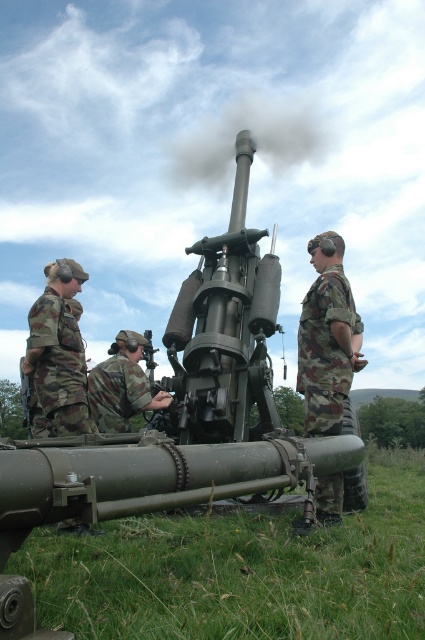
Which is in front, point (326, 493) or point (107, 406)?

Point (326, 493) is in front.

Does camo fabric soldier at center have a larger size compared to camouflage fabric uniform at center?

No.

At what (x,y) coordinates should I click in order to perform the action: click on camo fabric soldier at center. Please return your answer as a coordinate pair (x, y). Looking at the image, I should click on (326, 339).

Can you confirm if matte green cannon at center is positioned below camo fabric soldier at center?

No, matte green cannon at center is not below camo fabric soldier at center.

Between matte green cannon at center and camo fabric soldier at center, which one appears on the left side from the viewer's perspective?

From the viewer's perspective, matte green cannon at center appears more on the left side.

What do you see at coordinates (187, 410) in the screenshot?
I see `matte green cannon at center` at bounding box center [187, 410].

The image size is (425, 640). I want to click on matte green cannon at center, so click(x=187, y=410).

Who is taller, camo fabric soldier at center or camouflage uniform at left?

Standing taller between the two is camouflage uniform at left.

Locate an element on the screen. This screenshot has height=640, width=425. camo fabric soldier at center is located at coordinates (326, 339).

Identify the location of camo fabric soldier at center. The image size is (425, 640). (326, 339).